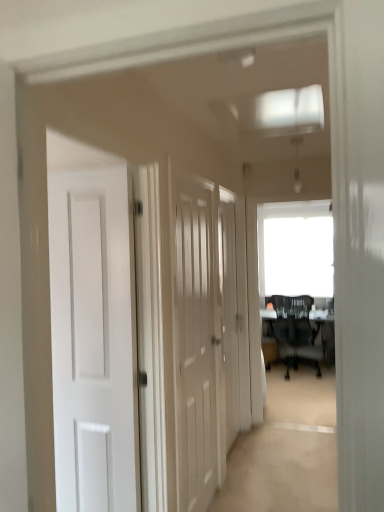
Question: Considering the positions of black mesh chair at center and white wood door at center, marked as the 2th door in a left-to-right arrangement, in the image, is black mesh chair at center bigger or smaller than white wood door at center, marked as the 2th door in a left-to-right arrangement,?

Choices:
 (A) big
 (B) small

Answer: (A)

Question: Is black mesh chair at center wider or thinner than white wood door at center, marked as the 2th door in a left-to-right arrangement?

Choices:
 (A) thin
 (B) wide

Answer: (B)

Question: Based on their relative distances, which object is nearer to the white wood door at center, which is counted as the 2th door, starting from the right?

Choices:
 (A) black mesh chair at center
 (B) white wood door at center, the first door in the back-to-front sequence

Answer: (B)

Question: Considering the real-world distances, which object is farthest from the black mesh chair at center?

Choices:
 (A) white wood door at center, which is the first door in right-to-left order
 (B) white wood door at center, the 2th door from the back

Answer: (B)